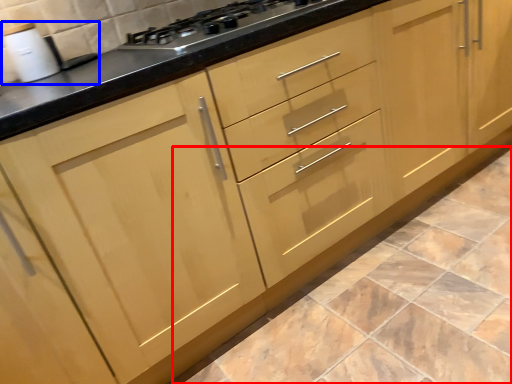
Question: Which object is further to the camera taking this photo, ceramic tile (highlighted by a red box) or sink (highlighted by a blue box)?

Choices:
 (A) ceramic tile
 (B) sink

Answer: (B)